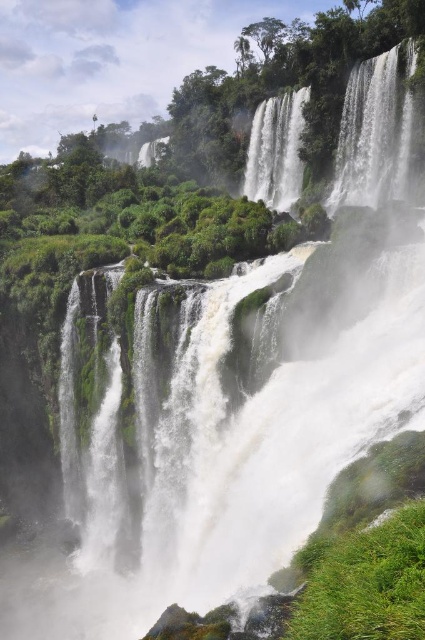
Which is more to the left, white frothy water at upper right or white frothy water at center?

white frothy water at center

Is point (379, 125) positioned behind point (297, 157)?

No, it is in front of (297, 157).

This screenshot has height=640, width=425. What are the coordinates of `white frothy water at upper right` in the screenshot? It's located at (374, 131).